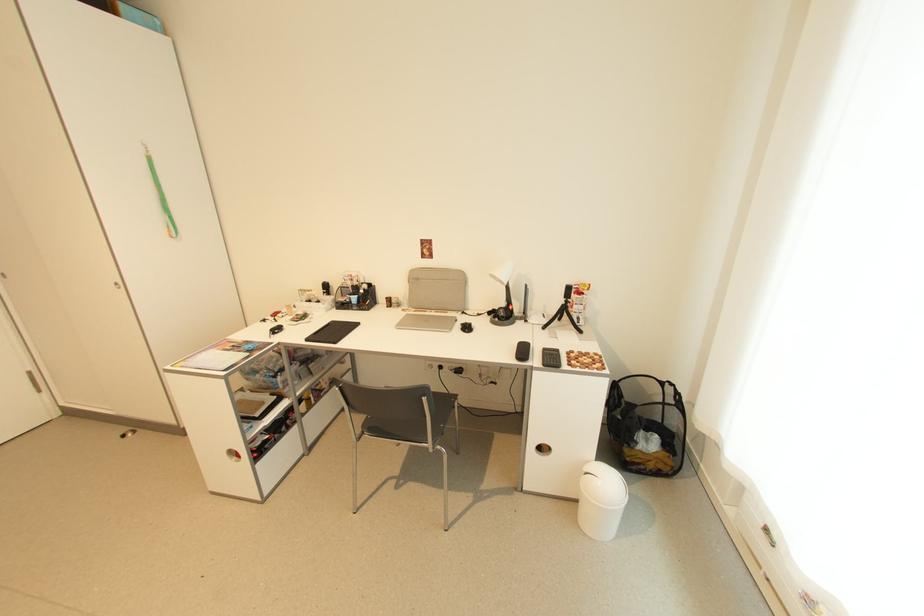
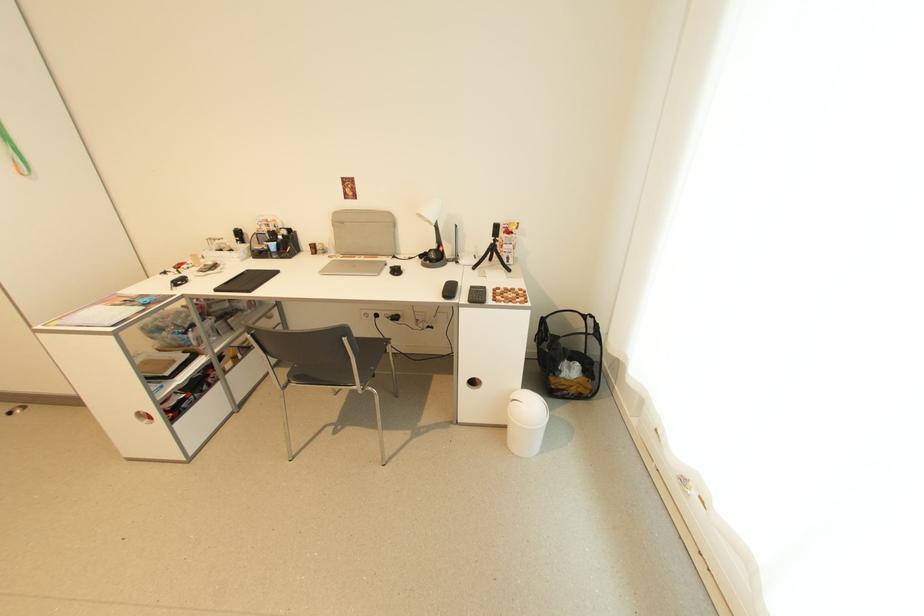
In the second image, find the point that corresponds to point (642, 450) in the first image.

(566, 377)